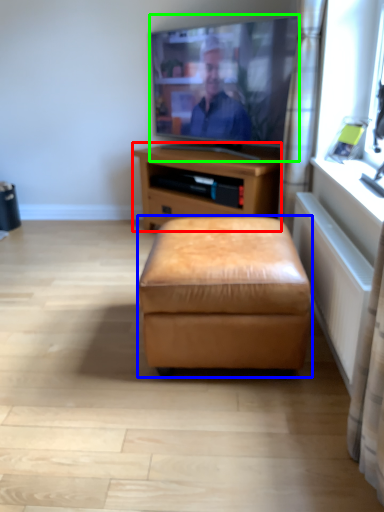
Question: Based on their relative distances, which object is farther from nightstand (highlighted by a red box)? Choose from stool (highlighted by a blue box) and television (highlighted by a green box).

Choices:
 (A) stool
 (B) television

Answer: (A)